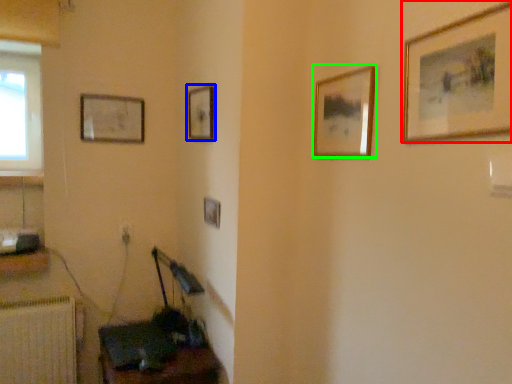
Question: Which object is positioned farthest from picture frame (highlighted by a red box)? Select from picture frame (highlighted by a blue box) and picture frame (highlighted by a green box).

Choices:
 (A) picture frame
 (B) picture frame

Answer: (A)